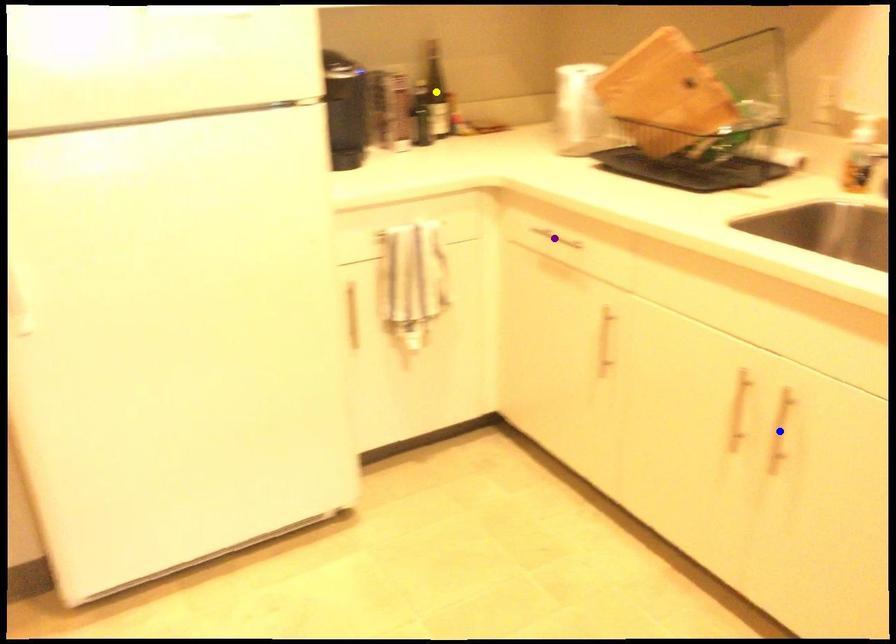
From the picture: Order these from nearest to farthest:
yellow point, blue point, purple point

yellow point → purple point → blue point